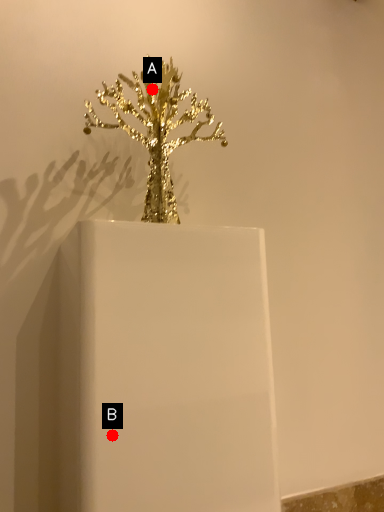
Question: Two points are circled on the image, labeled by A and B beside each circle. Which point appears farthest from the camera in this image?

Choices:
 (A) A is further
 (B) B is further

Answer: (A)